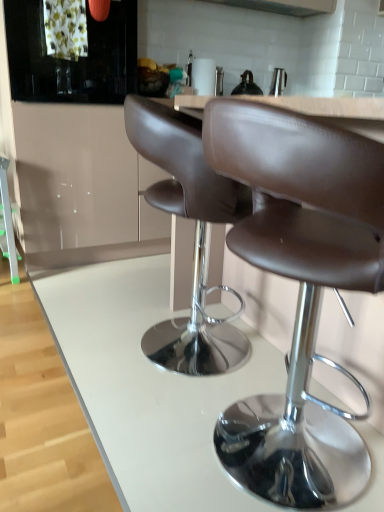
Question: Is white glossy counter at center at the back of green plastic ladder at left?

Choices:
 (A) no
 (B) yes

Answer: (A)

Question: Does green plastic ladder at left have a greater height compared to white glossy counter at center?

Choices:
 (A) no
 (B) yes

Answer: (B)

Question: Can you see green plastic ladder at left touching white glossy counter at center?

Choices:
 (A) yes
 (B) no

Answer: (B)

Question: Considering the relative sizes of green plastic ladder at left and white glossy counter at center in the image provided, is green plastic ladder at left smaller than white glossy counter at center?

Choices:
 (A) no
 (B) yes

Answer: (B)

Question: Considering the relative sizes of green plastic ladder at left and white glossy counter at center in the image provided, is green plastic ladder at left bigger than white glossy counter at center?

Choices:
 (A) yes
 (B) no

Answer: (B)

Question: Is green plastic ladder at left far from white glossy counter at center?

Choices:
 (A) no
 (B) yes

Answer: (A)

Question: From a real-world perspective, is white glossy counter at center positioned over brown leather stool at center based on gravity?

Choices:
 (A) yes
 (B) no

Answer: (B)

Question: Is white glossy counter at center further to the viewer compared to brown leather stool at center?

Choices:
 (A) yes
 (B) no

Answer: (A)

Question: Does white glossy counter at center appear on the left side of brown leather stool at center?

Choices:
 (A) yes
 (B) no

Answer: (A)

Question: Considering the relative sizes of white glossy counter at center and brown leather stool at center in the image provided, is white glossy counter at center thinner than brown leather stool at center?

Choices:
 (A) no
 (B) yes

Answer: (A)

Question: Is white glossy counter at center bigger than brown leather stool at center?

Choices:
 (A) no
 (B) yes

Answer: (A)

Question: Is white glossy counter at center positioned with its back to brown leather stool at center?

Choices:
 (A) yes
 (B) no

Answer: (B)

Question: Is brown leather stool at center facing away from satin silver exhaust hood at upper center?

Choices:
 (A) yes
 (B) no

Answer: (B)